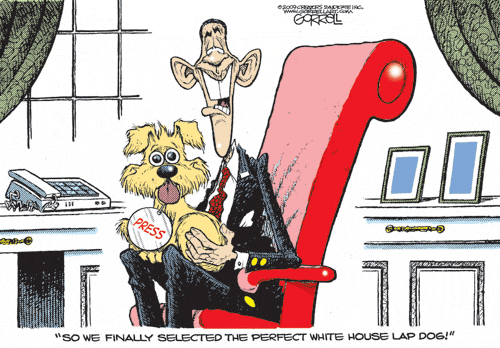
What are the coordinates of `curtains` in the screenshot? It's located at (452, 30), (477, 81), (493, 38), (27, 27), (12, 58), (16, 87), (45, 35).